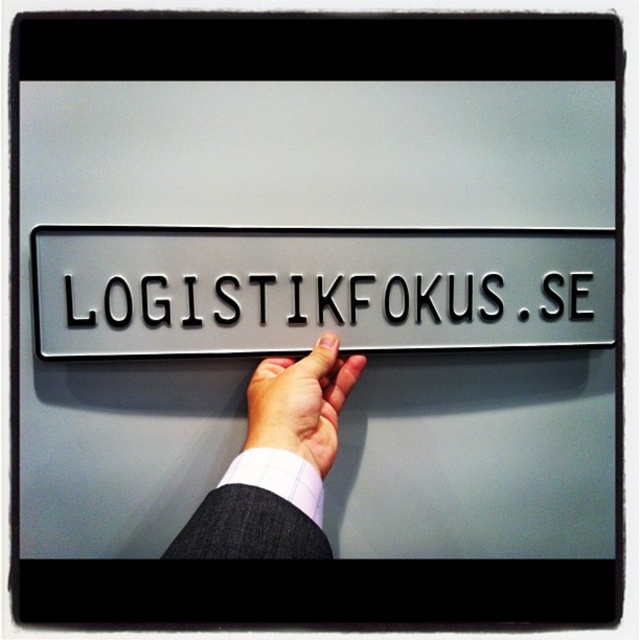
You are an observer looking at the signboard. Which object is closer to you between the white fabric at center and the light skin tone flesh at center?

The white fabric at center is closer to you because it is in front of the light skin tone flesh at center.

You are standing in front of the signboard and want to touch the white fabric at center. Where should you place your hand relative to the signboard?

You should place your hand at point (276, 464) on the signboard to touch the white fabric at center.